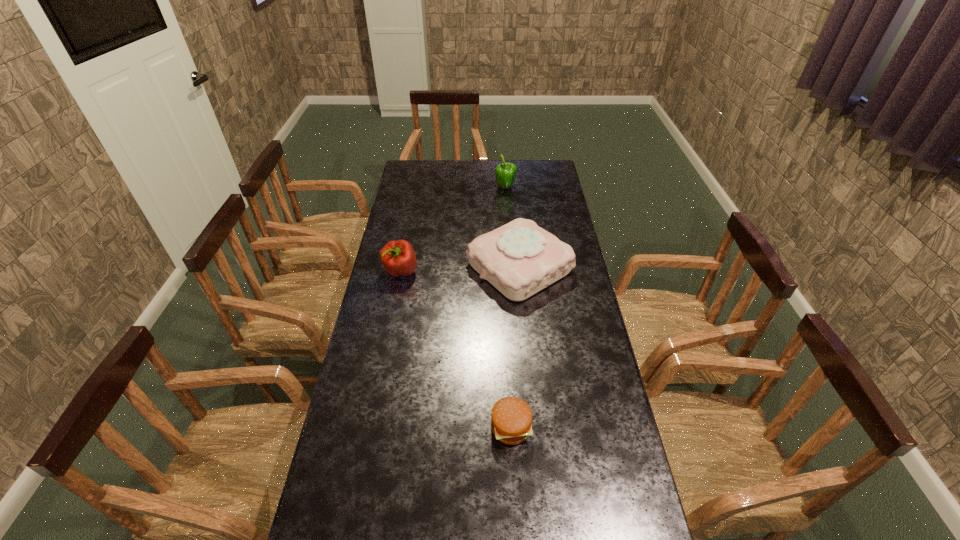
At what (x,y) coordinates should I click in order to perform the action: click on vacant region between the nearer bell pepper and the shortest object. Please return your answer as a coordinate pair (x, y). Looking at the image, I should click on point(456,349).

The height and width of the screenshot is (540, 960). I want to click on empty space that is in between the farthest object and the leftmost object, so click(453, 230).

Identify the location of free space between the nearest object and the cake. This screenshot has height=540, width=960. (516, 347).

In order to click on free space between the hamburger and the farther bell pepper in this screenshot , I will do `click(508, 308)`.

The image size is (960, 540). Find the location of `object that is the third closest to the left bell pepper`. object that is the third closest to the left bell pepper is located at coordinates (511, 417).

Locate which object is the closest to the cake. Please provide its 2D coordinates. Your answer should be formatted as a tuple, i.e. [(x, y)], where the tuple contains the x and y coordinates of a point satisfying the conditions above.

[(398, 257)]

Locate an element on the screen. Image resolution: width=960 pixels, height=540 pixels. vacant space that satisfies the following two spatial constraints: 1. on the back side of the cake; 2. on the right side of the hamburger is located at coordinates (502, 267).